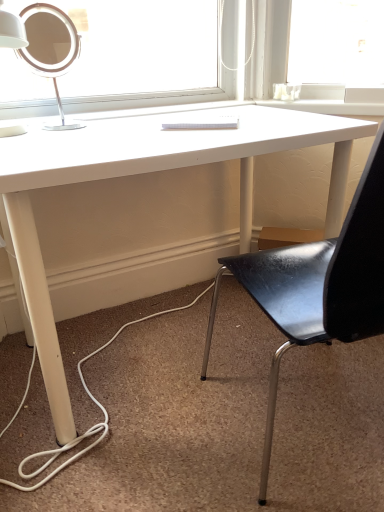
Question: Can we say white matte desk at center lies outside black leather chair at center?

Choices:
 (A) no
 (B) yes

Answer: (B)

Question: Does white matte desk at center have a larger size compared to black leather chair at center?

Choices:
 (A) no
 (B) yes

Answer: (B)

Question: Does white matte desk at center come behind black leather chair at center?

Choices:
 (A) no
 (B) yes

Answer: (B)

Question: Is white matte desk at center positioned far away from black leather chair at center?

Choices:
 (A) no
 (B) yes

Answer: (A)

Question: From a real-world perspective, is white matte desk at center located higher than black leather chair at center?

Choices:
 (A) no
 (B) yes

Answer: (A)

Question: Is black leather chair at center situated inside white matte desk at center or outside?

Choices:
 (A) outside
 (B) inside

Answer: (A)

Question: Is black leather chair at center bigger or smaller than white matte desk at center?

Choices:
 (A) small
 (B) big

Answer: (A)

Question: Is point (246, 259) positioned closer to the camera than point (130, 123)?

Choices:
 (A) farther
 (B) closer

Answer: (B)

Question: From the image's perspective, is black leather chair at center located above or below white matte desk at center?

Choices:
 (A) below
 (B) above

Answer: (A)

Question: Considering the positions of point (39, 25) and point (273, 384), is point (39, 25) closer or farther from the camera than point (273, 384)?

Choices:
 (A) closer
 (B) farther

Answer: (A)

Question: Considering the positions of matte white lamp at upper left and black leather chair at center in the image, is matte white lamp at upper left taller or shorter than black leather chair at center?

Choices:
 (A) tall
 (B) short

Answer: (B)

Question: From a real-world perspective, relative to black leather chair at center, is matte white lamp at upper left vertically above or below?

Choices:
 (A) below
 (B) above

Answer: (B)

Question: Is matte white lamp at upper left in front of or behind black leather chair at center in the image?

Choices:
 (A) behind
 (B) front

Answer: (A)

Question: From a real-world perspective, is white matte desk at center positioned above or below black leather chair at center?

Choices:
 (A) above
 (B) below

Answer: (B)

Question: Do you think white matte desk at center is within black leather chair at center, or outside of it?

Choices:
 (A) inside
 (B) outside

Answer: (B)